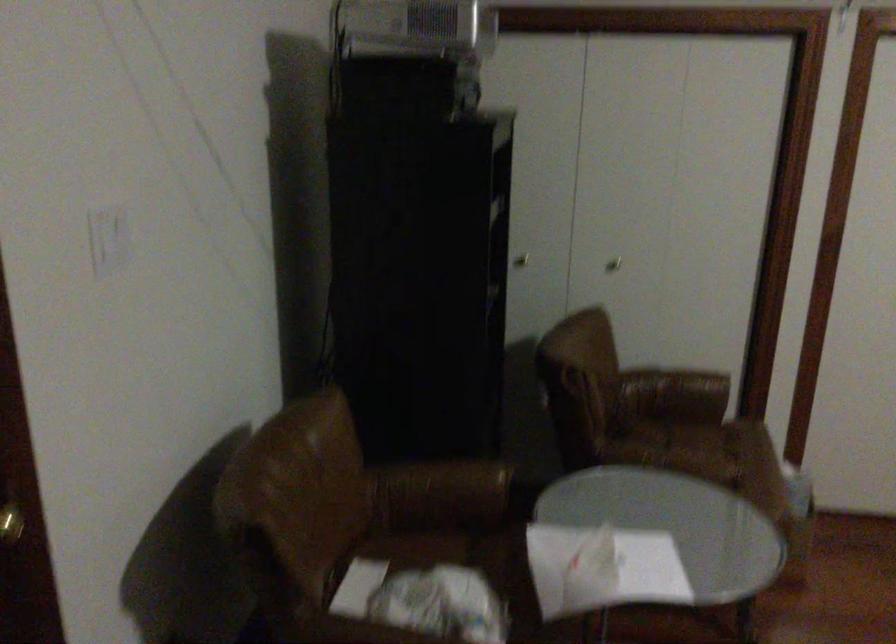
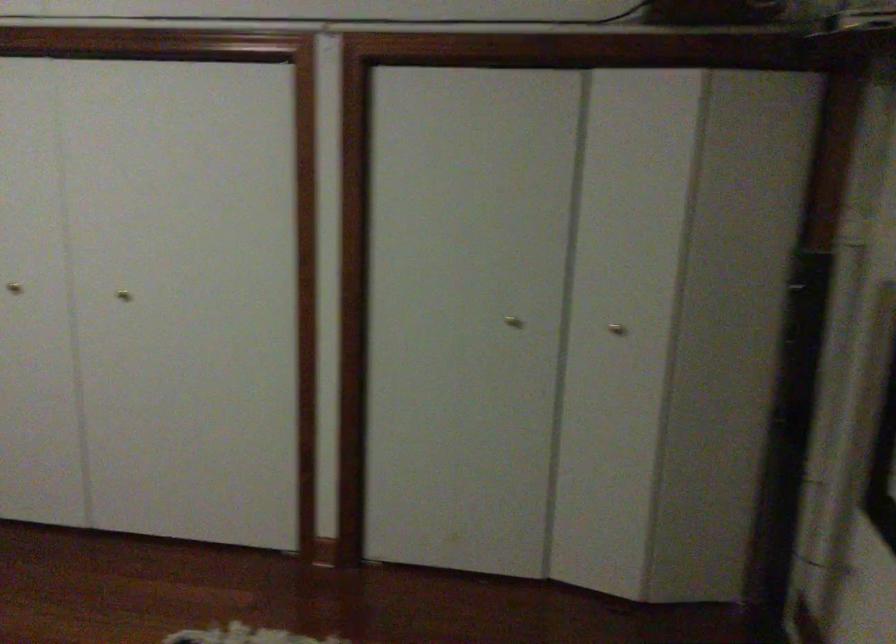
Question: In a continuous first-person perspective shot, in which direction is the camera moving?

Choices:
 (A) Left
 (B) Right
 (C) Forward
 (D) Backward

Answer: (B)